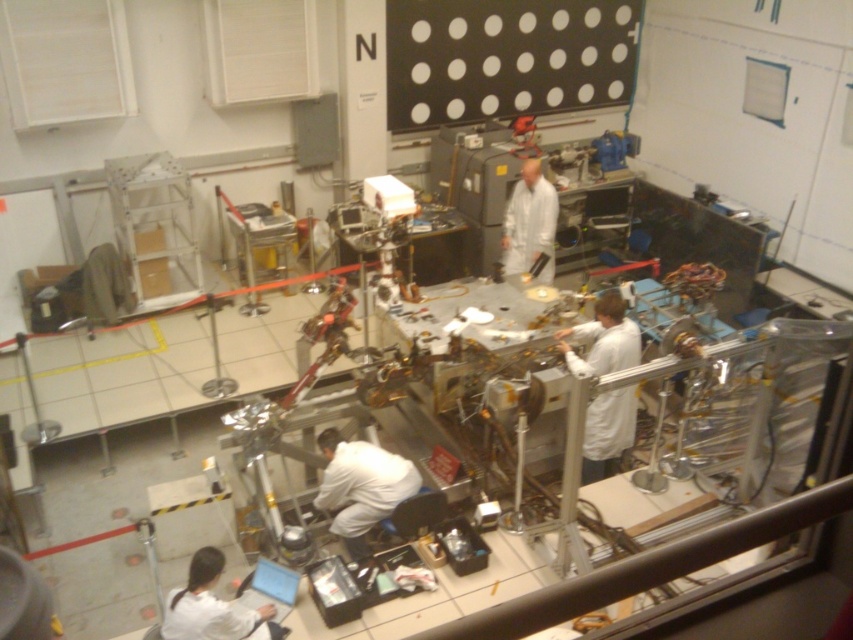
Looking at this image, you are a technician in the lab and need to reach both the point at coordinates point (339, 486) and the point at coordinates point (221, 557). Which point should you approach first if you want to reach the closer one first?

You should approach point (339, 486) first because it is closer to you than point (221, 557).

You are a new lab technician entering the room and need to locate your assigned workstation. You see two white lab coats in the scene. Which one is closer to the entrance, the white matte lab coat at lower center or the white lab coat at lower left?

The white lab coat at lower left is behind the white matte lab coat at lower center, so the white matte lab coat at lower center is closer to the entrance.